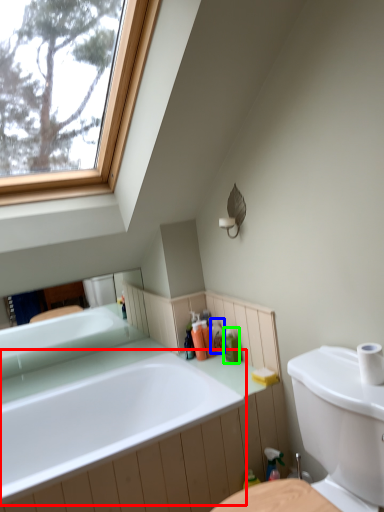
Question: Considering the real-world distances, which object is farthest from bathtub (highlighted by a red box)? toiletry (highlighted by a blue box) or toiletry (highlighted by a green box)?

Choices:
 (A) toiletry
 (B) toiletry

Answer: (A)